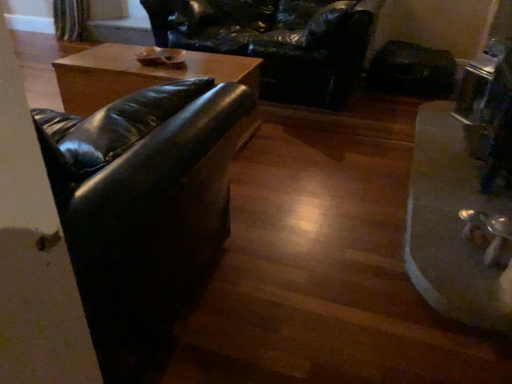
Locate an element on the screen. This screenshot has width=512, height=384. metallic silver tray at lower right is located at coordinates (450, 225).

Is black leather couch at left spatially inside black leather swivel chair at upper center, or outside of it?

black leather couch at left is not enclosed by black leather swivel chair at upper center.

Is black leather couch at left behind black leather swivel chair at upper center?

No, it is not.

From a real-world perspective, which is physically below, black leather couch at left or black leather swivel chair at upper center?

In real-world perspective, black leather swivel chair at upper center is lower.

Can you confirm if black leather couch at left is positioned to the right of black leather swivel chair at upper center?

Incorrect, black leather couch at left is not on the right side of black leather swivel chair at upper center.

From the image's perspective, between metallic silver tray at lower right and black leather couch at left, which one is located above?

metallic silver tray at lower right.

Is black leather couch at left located within metallic silver tray at lower right?

No, black leather couch at left is located outside of metallic silver tray at lower right.

In the scene shown: How much distance is there between metallic silver tray at lower right and black leather couch at left?

metallic silver tray at lower right and black leather couch at left are 1.04 meters apart from each other.

Is metallic silver tray at lower right aimed at black leather couch at left?

No, metallic silver tray at lower right is not oriented towards black leather couch at left.

Is black leather swivel chair at upper center shorter than black leather couch at left?

Yes, black leather swivel chair at upper center is shorter than black leather couch at left.

Considering the points (289, 3) and (83, 178), which point is in front, point (289, 3) or point (83, 178)?

Positioned in front is point (83, 178).

The width and height of the screenshot is (512, 384). In order to click on studio couch in front of the black leather swivel chair at upper center in this screenshot , I will do `click(142, 205)`.

What's the angular difference between black leather swivel chair at upper center and black leather couch at left's facing directions?

The angle between the facing direction of black leather swivel chair at upper center and the facing direction of black leather couch at left is 180 degrees.

Which of these two, black leather couch at left or metallic silver tray at lower right, is smaller?

With smaller size is metallic silver tray at lower right.

Would you consider black leather couch at left to be distant from metallic silver tray at lower right?

Absolutely, black leather couch at left is distant from metallic silver tray at lower right.

From the picture: Can you tell me how much black leather couch at left and metallic silver tray at lower right differ in facing direction?

The angle between the facing direction of black leather couch at left and the facing direction of metallic silver tray at lower right is 89.2 degrees.

From the image's perspective, between black leather couch at left and metallic silver tray at lower right, which one is located above?

metallic silver tray at lower right is shown above in the image.

The image size is (512, 384). I want to click on wide lying in front of the black leather swivel chair at upper center, so click(x=450, y=225).

Considering the relative sizes of metallic silver tray at lower right and black leather swivel chair at upper center in the image provided, is metallic silver tray at lower right thinner than black leather swivel chair at upper center?

Correct, the width of metallic silver tray at lower right is less than that of black leather swivel chair at upper center.

Who is taller, metallic silver tray at lower right or black leather swivel chair at upper center?

Standing taller between the two is black leather swivel chair at upper center.

Considering the relative sizes of black leather swivel chair at upper center and metallic silver tray at lower right in the image provided, is black leather swivel chair at upper center bigger than metallic silver tray at lower right?

Yes, black leather swivel chair at upper center is bigger than metallic silver tray at lower right.

Does black leather swivel chair at upper center have a greater width compared to metallic silver tray at lower right?

Yes.

What's the angular difference between black leather swivel chair at upper center and metallic silver tray at lower right's facing directions?

The angular difference between black leather swivel chair at upper center and metallic silver tray at lower right is 90.8 degrees.

I want to click on studio couch above the black leather swivel chair at upper center (from a real-world perspective), so pyautogui.click(x=142, y=205).

Identify the location of wide below the black leather couch at left (from a real-world perspective). (450, 225).

Looking at this image, estimate the real-world distances between objects in this image. Which object is further from metallic silver tray at lower right, black leather couch at left or black leather swivel chair at upper center?

black leather swivel chair at upper center is positioned further to the anchor metallic silver tray at lower right.

From the image, which object appears to be nearer to metallic silver tray at lower right, black leather swivel chair at upper center or black leather couch at left?

black leather couch at left is closer to metallic silver tray at lower right.

Considering their positions, is metallic silver tray at lower right positioned further to black leather couch at left than black leather swivel chair at upper center?

Based on the image, black leather swivel chair at upper center appears to be further to black leather couch at left.

Looking at the image, which one is located closer to black leather swivel chair at upper center, metallic silver tray at lower right or black leather couch at left?

metallic silver tray at lower right is positioned closer to the anchor black leather swivel chair at upper center.

Based on their spatial positions, is black leather couch at left or metallic silver tray at lower right closer to black leather swivel chair at upper center?

metallic silver tray at lower right.

Considering their positions, is black leather swivel chair at upper center positioned closer to black leather couch at left than metallic silver tray at lower right?

The object closer to black leather couch at left is metallic silver tray at lower right.

Locate an element on the screen. The height and width of the screenshot is (384, 512). wide positioned between black leather couch at left and black leather swivel chair at upper center from near to far is located at coordinates (450, 225).